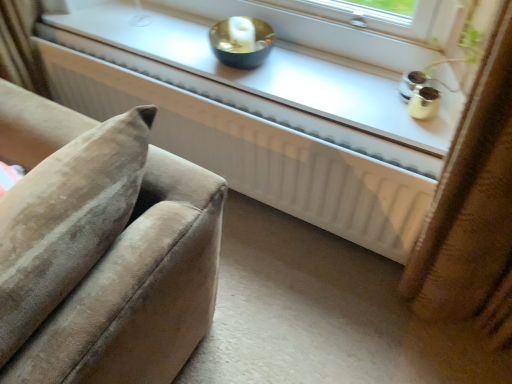
Question: Does white glossy window sill at upper center have a greater width compared to white matte radiator at center?

Choices:
 (A) yes
 (B) no

Answer: (A)

Question: Is white glossy window sill at upper center further to camera compared to white matte radiator at center?

Choices:
 (A) yes
 (B) no

Answer: (A)

Question: Can you confirm if white glossy window sill at upper center is taller than white matte radiator at center?

Choices:
 (A) yes
 (B) no

Answer: (B)

Question: From the image's perspective, would you say white glossy window sill at upper center is shown under white matte radiator at center?

Choices:
 (A) no
 (B) yes

Answer: (A)

Question: Can you confirm if white glossy window sill at upper center is smaller than white matte radiator at center?

Choices:
 (A) no
 (B) yes

Answer: (B)

Question: Is white glossy window sill at upper center bigger than white matte radiator at center?

Choices:
 (A) yes
 (B) no

Answer: (B)

Question: Can you confirm if white matte radiator at center is shorter than white glossy window sill at upper center?

Choices:
 (A) no
 (B) yes

Answer: (A)

Question: From a real-world perspective, is white matte radiator at center under white glossy window sill at upper center?

Choices:
 (A) no
 (B) yes

Answer: (B)

Question: Is white matte radiator at center closer to the viewer compared to white glossy window sill at upper center?

Choices:
 (A) yes
 (B) no

Answer: (A)

Question: Considering the relative sizes of white matte radiator at center and white glossy window sill at upper center in the image provided, is white matte radiator at center smaller than white glossy window sill at upper center?

Choices:
 (A) yes
 (B) no

Answer: (B)

Question: From a real-world perspective, is white matte radiator at center over white glossy window sill at upper center?

Choices:
 (A) yes
 (B) no

Answer: (B)

Question: From the image's perspective, is white matte radiator at center located above white glossy window sill at upper center?

Choices:
 (A) no
 (B) yes

Answer: (A)

Question: From the image's perspective, is white glossy window sill at upper center above or below white matte radiator at center?

Choices:
 (A) above
 (B) below

Answer: (A)